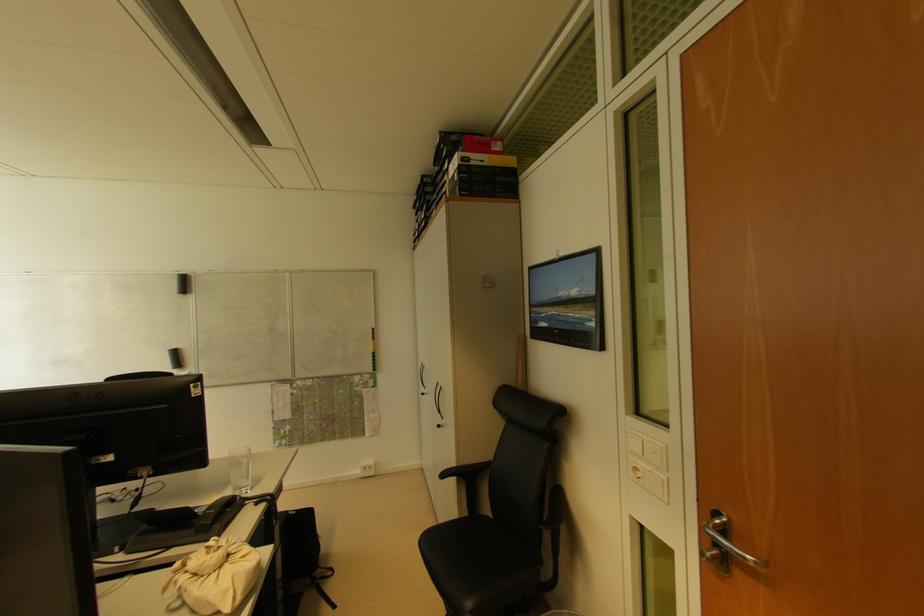
Identify the location of white light switch. (648, 464).